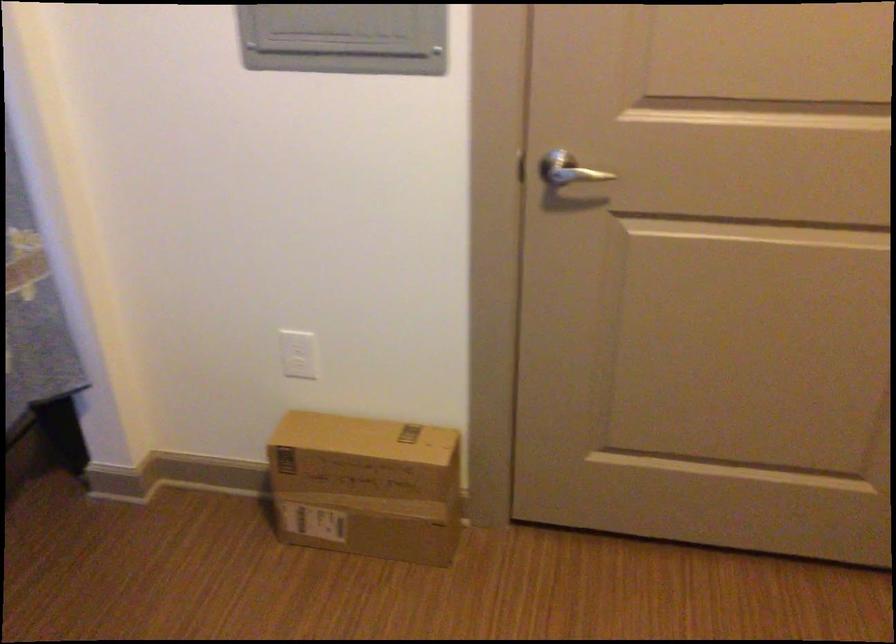
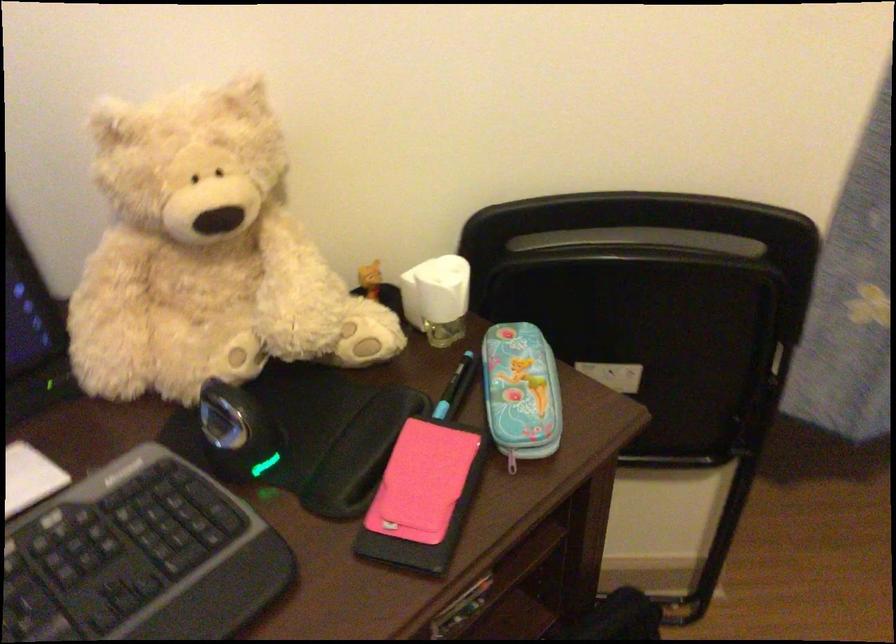
First-person continuous shooting, in which direction is the camera rotating?

The rotation direction of the camera is left-down.